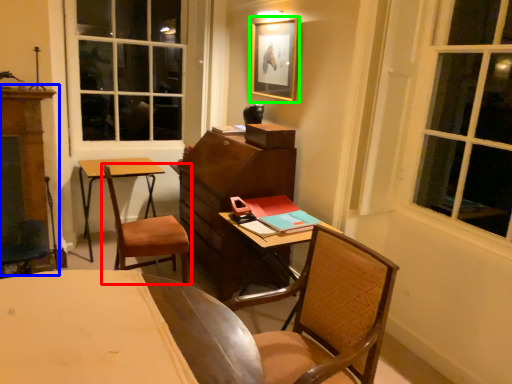
Question: Estimate the real-world distances between objects in this image. Which object is farther from chair (highlighted by a red box), dresser (highlighted by a blue box) or picture frame (highlighted by a green box)?

Choices:
 (A) dresser
 (B) picture frame

Answer: (B)